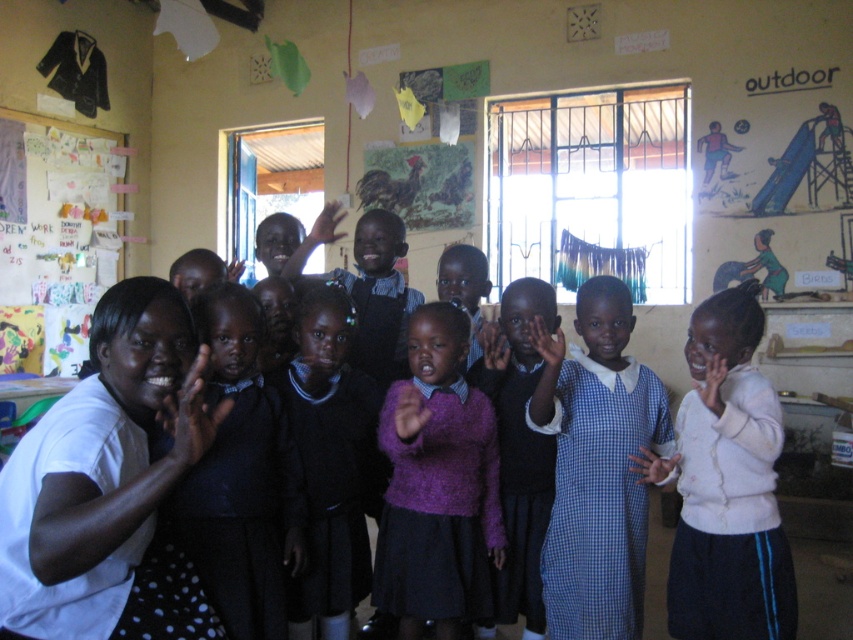
Question: Which point appears farthest from the camera in this image?

Choices:
 (A) (160, 490)
 (B) (340, 378)

Answer: (B)

Question: Does white matte shirt at left have a greater width compared to matte purple sweater at center?

Choices:
 (A) no
 (B) yes

Answer: (B)

Question: Does white soft sweater at center come in front of purple fuzzy sweater at center?

Choices:
 (A) yes
 (B) no

Answer: (A)

Question: Among these points, which one is farthest from the camera?

Choices:
 (A) (490, 365)
 (B) (749, 493)
 (C) (424, 593)
 (D) (64, 257)

Answer: (D)

Question: Which point is farther from the camera taking this photo?

Choices:
 (A) (340, 232)
 (B) (257, 372)
 (C) (553, 580)
 (D) (270, 380)

Answer: (A)

Question: Where is colored paper collage at upper left located in relation to matte purple sweater at center in the image?

Choices:
 (A) below
 (B) above

Answer: (B)